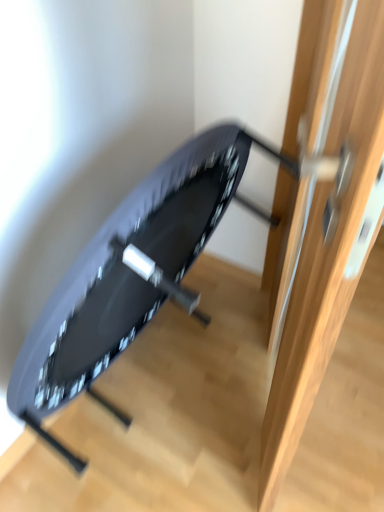
Measure the distance between point [80,350] and camera.

Point [80,350] and camera are 1.17 meters apart.

Image resolution: width=384 pixels, height=512 pixels. What do you see at coordinates (127, 278) in the screenshot? I see `matte black swivel chair at center` at bounding box center [127, 278].

I want to click on matte black swivel chair at center, so click(x=127, y=278).

Locate an element on the screen. wooden door at center is located at coordinates (323, 214).

This screenshot has height=512, width=384. Describe the element at coordinates (323, 214) in the screenshot. I see `wooden door at center` at that location.

At what (x,y) coordinates should I click in order to perform the action: click on matte black swivel chair at center. Please return your answer as a coordinate pair (x, y). Looking at the image, I should click on (127, 278).

Considering the relative positions of matte black swivel chair at center and wooden door at center in the image provided, is matte black swivel chair at center to the right of wooden door at center from the viewer's perspective?

No.

Does matte black swivel chair at center come behind wooden door at center?

Yes, matte black swivel chair at center is further from the viewer.

Is point (129, 326) closer to camera compared to point (297, 264)?

No, it is not.

From the image's perspective, is matte black swivel chair at center located above or below wooden door at center?

Clearly, from the image's perspective, matte black swivel chair at center is below wooden door at center.

From a real-world perspective, which object rests below the other?

matte black swivel chair at center is physically lower.

Is matte black swivel chair at center wider than wooden door at center?

Incorrect, the width of matte black swivel chair at center does not surpass that of wooden door at center.

Considering the sizes of objects matte black swivel chair at center and wooden door at center in the image provided, who is taller, matte black swivel chair at center or wooden door at center?

With more height is wooden door at center.

Is matte black swivel chair at center smaller than wooden door at center?

Yes.

Is matte black swivel chair at center positioned beyond the bounds of wooden door at center?

Yes.

Is there a large distance between matte black swivel chair at center and wooden door at center?

No, matte black swivel chair at center is not far from wooden door at center.

Is matte black swivel chair at center turned away from wooden door at center?

matte black swivel chair at center does not have its back to wooden door at center.

Can you tell me how much matte black swivel chair at center and wooden door at center differ in facing direction?

The angle between the facing direction of matte black swivel chair at center and the facing direction of wooden door at center is 24.1 degrees.

How distant is matte black swivel chair at center from wooden door at center?

14.49 inches.

Identify the location of swivel chair below the wooden door at center (from the image's perspective). (127, 278).

Between wooden door at center and matte black swivel chair at center, which one appears on the right side from the viewer's perspective?

wooden door at center.

Who is more distant, wooden door at center or matte black swivel chair at center?

matte black swivel chair at center is further from the camera.

Considering the points (306, 87) and (82, 375), which point is behind, point (306, 87) or point (82, 375)?

The point (82, 375) is more distant.

From the image's perspective, is wooden door at center on matte black swivel chair at center?

Correct, wooden door at center appears higher than matte black swivel chair at center in the image.

In the scene shown: From a real-world perspective, is wooden door at center located higher than matte black swivel chair at center?

Yes, from a real-world perspective, wooden door at center is over matte black swivel chair at center

Which object is wider, wooden door at center or matte black swivel chair at center?

wooden door at center.

Considering the sizes of objects wooden door at center and matte black swivel chair at center in the image provided, who is shorter, wooden door at center or matte black swivel chair at center?

matte black swivel chair at center is shorter.

Is wooden door at center smaller than matte black swivel chair at center?

No.

Is wooden door at center spatially inside matte black swivel chair at center, or outside of it?

wooden door at center is not enclosed by matte black swivel chair at center.

Is wooden door at center far away from matte black swivel chair at center?

Actually, wooden door at center and matte black swivel chair at center are a little close together.

Is wooden door at center turned away from matte black swivel chair at center?

Yes, wooden door at center is facing away from matte black swivel chair at center.

Locate an element on the screen. swivel chair below the wooden door at center (from a real-world perspective) is located at coordinates (127, 278).

The image size is (384, 512). In order to click on door on the right of matte black swivel chair at center in this screenshot , I will do `click(323, 214)`.

Find the location of a particular element. The width and height of the screenshot is (384, 512). swivel chair below the wooden door at center (from a real-world perspective) is located at coordinates (127, 278).